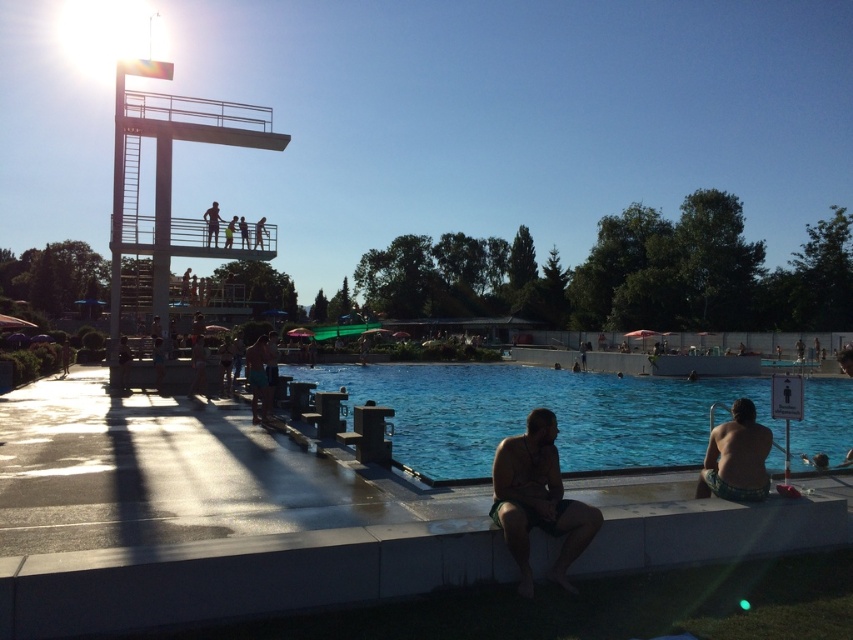
This screenshot has width=853, height=640. Describe the element at coordinates (257, 378) in the screenshot. I see `matte green shorts at center` at that location.

Between point (253, 369) and point (239, 218), which one is positioned in front?

Positioned in front is point (253, 369).

Is point (263, 403) positioned after point (245, 236)?

No, it is in front of (245, 236).

This screenshot has height=640, width=853. In order to click on matte green shorts at center in this screenshot , I will do `click(257, 378)`.

Is blue glossy water at center above green textured shorts at lower right?

No.

Locate an element on the screen. The image size is (853, 640). blue glossy water at center is located at coordinates (535, 406).

What do you see at coordinates (535, 406) in the screenshot?
I see `blue glossy water at center` at bounding box center [535, 406].

You are a GUI agent. You are given a task and a screenshot of the screen. Output one action in this format:
    pyautogui.click(x=<x>, y=<y>)
    Task: Click on the blue glossy water at center
    This screenshot has width=853, height=640.
    Given the screenshot: What is the action you would take?
    pyautogui.click(x=535, y=406)

Is matte black shorts at upper center to the right of tan skin human at upper center from the viewer's perspective?

In fact, matte black shorts at upper center is to the left of tan skin human at upper center.

Can you confirm if matte black shorts at upper center is shorter than tan skin human at upper center?

Yes.

Identify the location of matte black shorts at upper center. Image resolution: width=853 pixels, height=640 pixels. click(x=229, y=230).

Find the location of `matte black shorts at upper center`. matte black shorts at upper center is located at coordinates (229, 230).